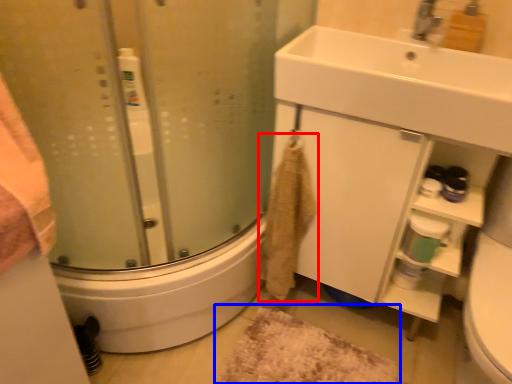
Question: Which object appears farthest to the camera in this image, bath towel (highlighted by a red box) or bath mat (highlighted by a blue box)?

Choices:
 (A) bath towel
 (B) bath mat

Answer: (B)